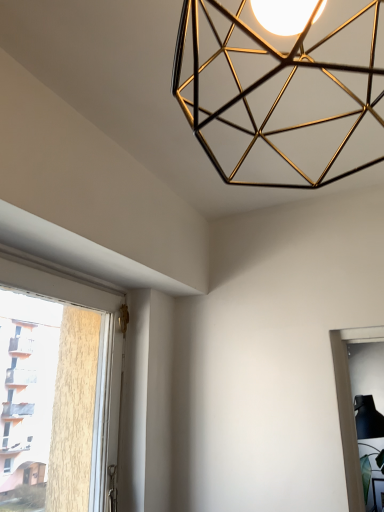
Question: Is transparent glass window at lower right, the 1th window positioned from the bottom, taller than gold metallic geometric light fixture at upper center?

Choices:
 (A) yes
 (B) no

Answer: (A)

Question: Considering the relative sizes of transparent glass window at lower right, which is counted as the 2th window, starting from the top, and gold metallic geometric light fixture at upper center in the image provided, is transparent glass window at lower right, which is counted as the 2th window, starting from the top, shorter than gold metallic geometric light fixture at upper center?

Choices:
 (A) yes
 (B) no

Answer: (B)

Question: Is transparent glass window at lower right, the 1th window positioned from the bottom, turned away from gold metallic geometric light fixture at upper center?

Choices:
 (A) yes
 (B) no

Answer: (B)

Question: Is gold metallic geometric light fixture at upper center a part of transparent glass window at lower right, which is counted as the 2th window, starting from the top?

Choices:
 (A) no
 (B) yes

Answer: (A)

Question: Is the position of transparent glass window at lower right, the 1th window positioned from the bottom, more distant than that of gold metallic geometric light fixture at upper center?

Choices:
 (A) no
 (B) yes

Answer: (B)

Question: Do you think gold metallic geometric light fixture at upper center is within transparent glass window at lower right, which is counted as the 2th window, starting from the top, or outside of it?

Choices:
 (A) inside
 (B) outside

Answer: (B)

Question: Considering their positions, is gold metallic geometric light fixture at upper center located in front of or behind transparent glass window at lower right, which is the second window in left-to-right order?

Choices:
 (A) front
 (B) behind

Answer: (A)

Question: From a real-world perspective, is gold metallic geometric light fixture at upper center physically located above or below transparent glass window at lower right, arranged as the first window when viewed from the back?

Choices:
 (A) above
 (B) below

Answer: (A)

Question: From the image's perspective, is gold metallic geometric light fixture at upper center above or below transparent glass window at lower right, which is counted as the 2th window, starting from the top?

Choices:
 (A) above
 (B) below

Answer: (A)

Question: Based on their positions, is white plastic window at left, the 2th window from the right, located to the left or right of gold metallic geometric light fixture at upper center?

Choices:
 (A) right
 (B) left

Answer: (B)

Question: From the image's perspective, relative to gold metallic geometric light fixture at upper center, is white plastic window at left, the 2th window when ordered from bottom to top, above or below?

Choices:
 (A) above
 (B) below

Answer: (B)

Question: Is white plastic window at left, the 2th window when ordered from bottom to top, wider or thinner than gold metallic geometric light fixture at upper center?

Choices:
 (A) thin
 (B) wide

Answer: (A)

Question: Which is correct: white plastic window at left, arranged as the 1th window when viewed from the left, is inside gold metallic geometric light fixture at upper center, or outside of it?

Choices:
 (A) outside
 (B) inside

Answer: (A)

Question: Choose the correct answer: Is gold metallic geometric light fixture at upper center inside white plastic window at left, arranged as the 1th window when viewed from the top, or outside it?

Choices:
 (A) inside
 (B) outside

Answer: (B)

Question: Is gold metallic geometric light fixture at upper center in front of or behind white plastic window at left, arranged as the 1th window when viewed from the top, in the image?

Choices:
 (A) front
 (B) behind

Answer: (A)